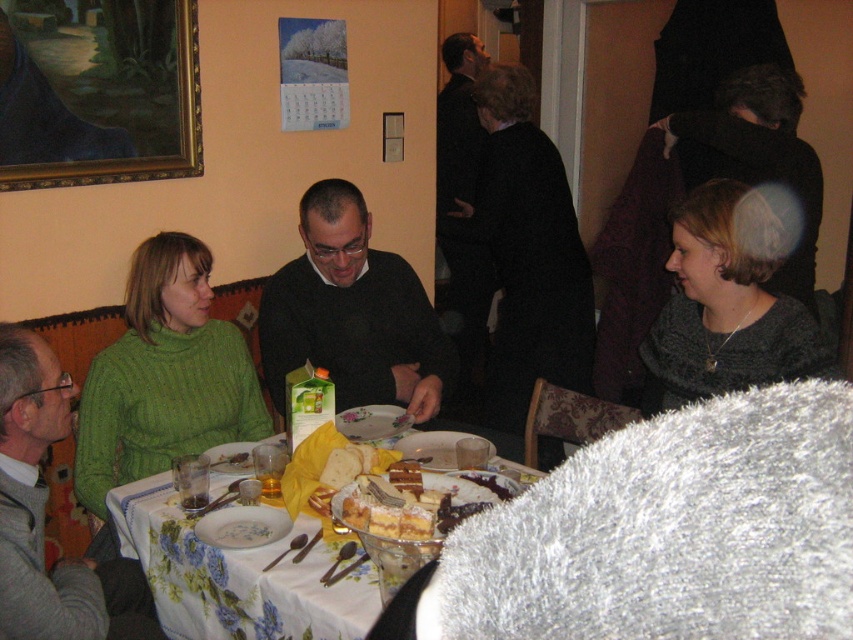
You are a guest at this dinner and want to place your phone on the green knitted sweater at left or the smooth white plate at center. Which surface can better support your phone without it tilting?

The green knitted sweater at left has a greater height compared to the smooth white plate at center, so placing the phone on the green knitted sweater at left would provide a more stable and less tilting surface.

You are a guest sitting at the table and want to admire the wooden framed painting at upper left. Since you are looking directly at the smooth white plate at center, which object is above the other?

The wooden framed painting at upper left is positioned over the smooth white plate at center, so the wooden framed painting at upper left is above the smooth white plate at center.

You are a guest at the dinner and want to place a small gift on the table without moving any existing items. Which item, the dark green sweater at center or the floral tablecloth at center, would allow you to place the gift on top of it more easily?

The dark green sweater at center is thinner than the floral tablecloth at center, so placing the gift on the dark green sweater at center would be easier since it takes up less space.